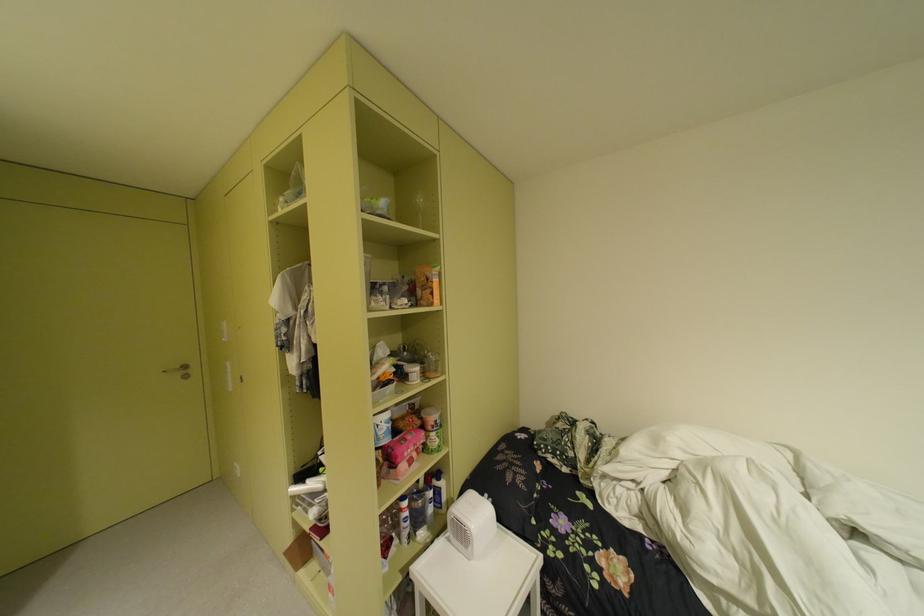
Identify the location of clear wine glass. (419, 207).